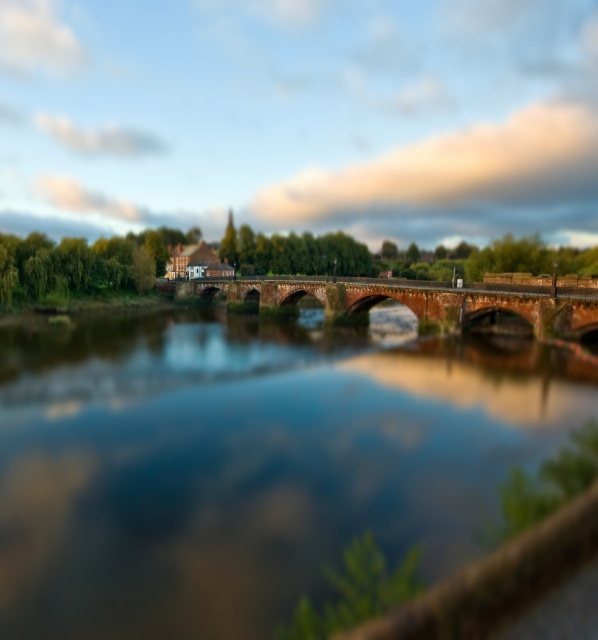
Question: Which point appears closest to the camera in this image?

Choices:
 (A) (332, 364)
 (B) (526, 312)

Answer: (A)

Question: Among these points, which one is nearest to the camera?

Choices:
 (A) (416, 300)
 (B) (89, 378)

Answer: (B)

Question: Can you confirm if brown stone bridge at center is positioned above red brick bridge at center?

Choices:
 (A) yes
 (B) no

Answer: (B)

Question: Where is brown stone bridge at center located in relation to red brick bridge at center in the image?

Choices:
 (A) left
 (B) right

Answer: (A)

Question: Is brown stone bridge at center closer to camera compared to red brick bridge at center?

Choices:
 (A) no
 (B) yes

Answer: (B)